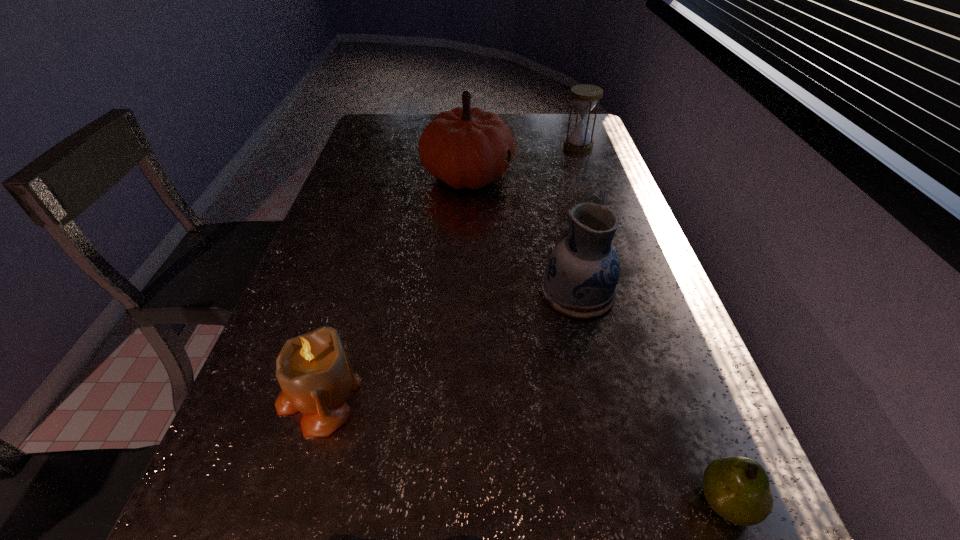
At what (x,y) coordinates should I click in order to perform the action: click on free location at the right edge of the desktop. Please return your answer as a coordinate pair (x, y). Looking at the image, I should click on (673, 521).

Image resolution: width=960 pixels, height=540 pixels. I want to click on vacant region at the far left corner, so click(400, 143).

This screenshot has width=960, height=540. Identify the location of free area in between the pear and the leftmost object. (522, 448).

Where is `vacant point located between the pear and the pumpkin`? This screenshot has width=960, height=540. vacant point located between the pear and the pumpkin is located at coordinates (597, 338).

At what (x,y) coordinates should I click in order to perform the action: click on vacant area that lies between the second shortest object and the pumpkin. Please return your answer as a coordinate pair (x, y). This screenshot has width=960, height=540. Looking at the image, I should click on (597, 338).

Locate an element on the screen. The height and width of the screenshot is (540, 960). free space between the third shortest object and the pottery is located at coordinates (448, 343).

Find the location of `vacant space that is in between the candle and the fourth nearest object`. vacant space that is in between the candle and the fourth nearest object is located at coordinates (448, 343).

The width and height of the screenshot is (960, 540). I want to click on vacant region between the pumpkin and the fifth farthest object, so click(x=597, y=338).

Locate an element on the screen. vacant space that's between the fourth tallest object and the hourglass is located at coordinates (448, 271).

Identify the location of free point between the fourth nearest object and the pear. This screenshot has width=960, height=540. [x=652, y=397].